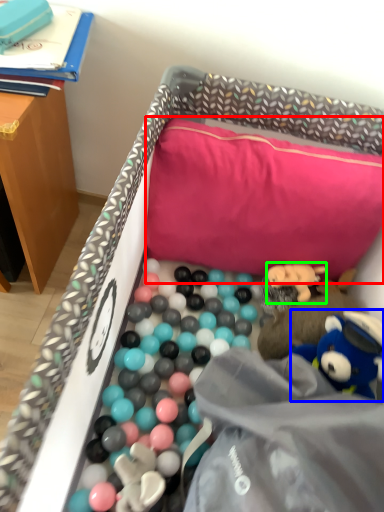
Question: Based on their relative distances, which object is nearer to pillow (highlighted by a red box)? Choose from toy (highlighted by a blue box) and toy (highlighted by a green box).

Choices:
 (A) toy
 (B) toy

Answer: (B)